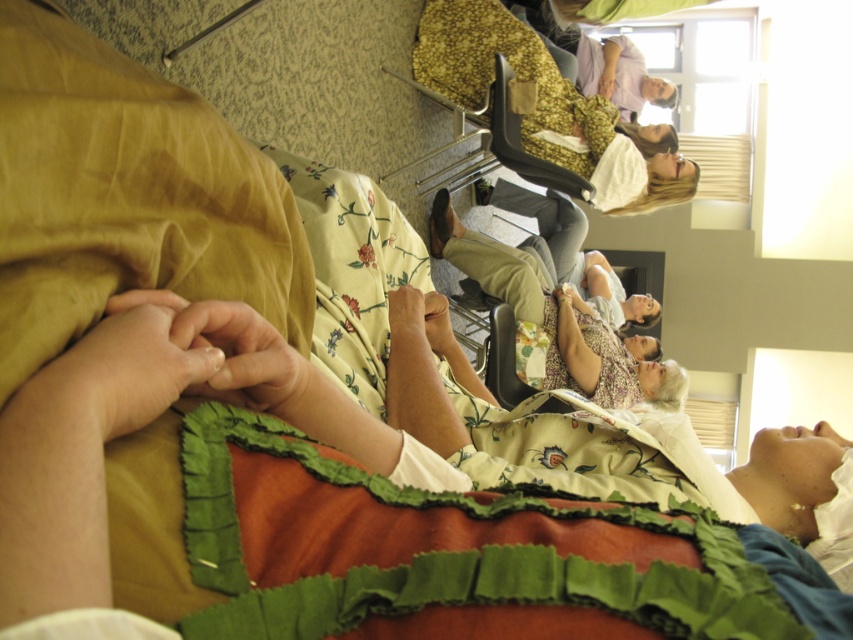
Question: Is floral fabric dress at upper center below floral fabric dress at center?

Choices:
 (A) yes
 (B) no

Answer: (B)

Question: Does floral fabric dress at upper center come behind floral fabric dress at center?

Choices:
 (A) yes
 (B) no

Answer: (B)

Question: Can you confirm if floral fabric dress at upper center is positioned above floral fabric dress at center?

Choices:
 (A) yes
 (B) no

Answer: (A)

Question: Which point is farther from the camera taking this photo?

Choices:
 (A) (595, 397)
 (B) (554, 77)

Answer: (B)

Question: Among these points, which one is farthest from the camera?

Choices:
 (A) (498, 29)
 (B) (573, 330)

Answer: (A)

Question: Which point is farther from the camera taking this photo?

Choices:
 (A) (451, 52)
 (B) (554, 296)

Answer: (A)